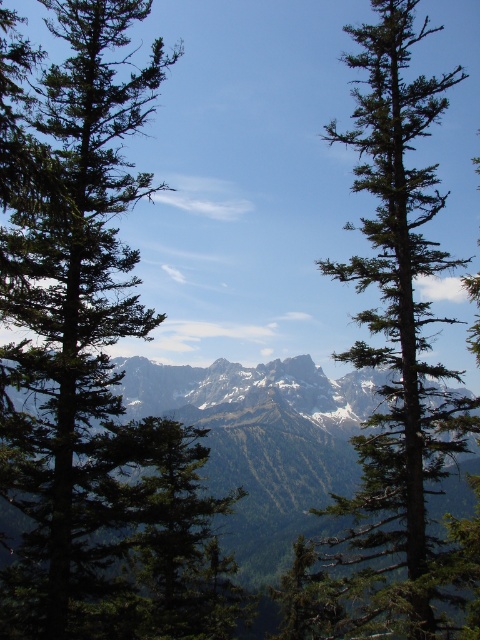
You are standing in the mountain landscape and see two points marked in the image. The first point is at coordinates point (116, 316) and the second is at point (391, 310). Which point is closer to you?

Point (116, 316) is in front of point (391, 310), so the first point is closer to you.